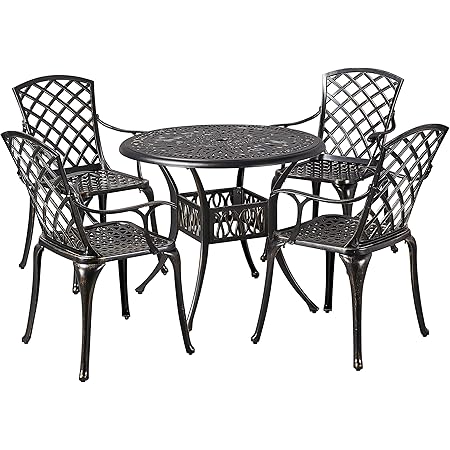
I want to click on middle border connecting table legs, so click(236, 219), click(185, 222), click(189, 191), click(246, 193).